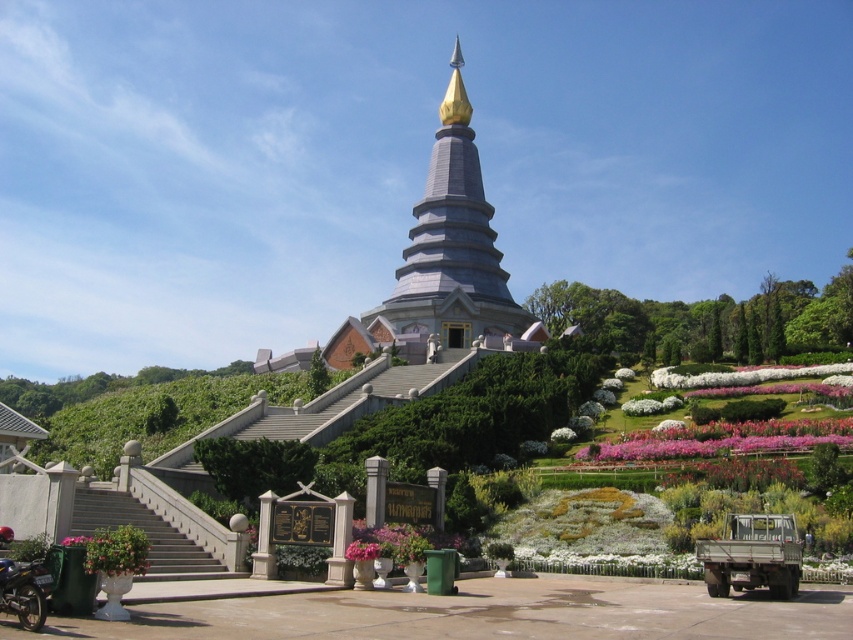
Based on the photo, you are a visitor standing at the entrance of the pagoda and see both the gray concrete stairs at lower left and the pink fabric flower at lower left. Which object is positioned more to the left side?

The gray concrete stairs at lower left are positioned to the left of the pink fabric flower at lower left, so the gray concrete stairs at lower left are more to the left side.